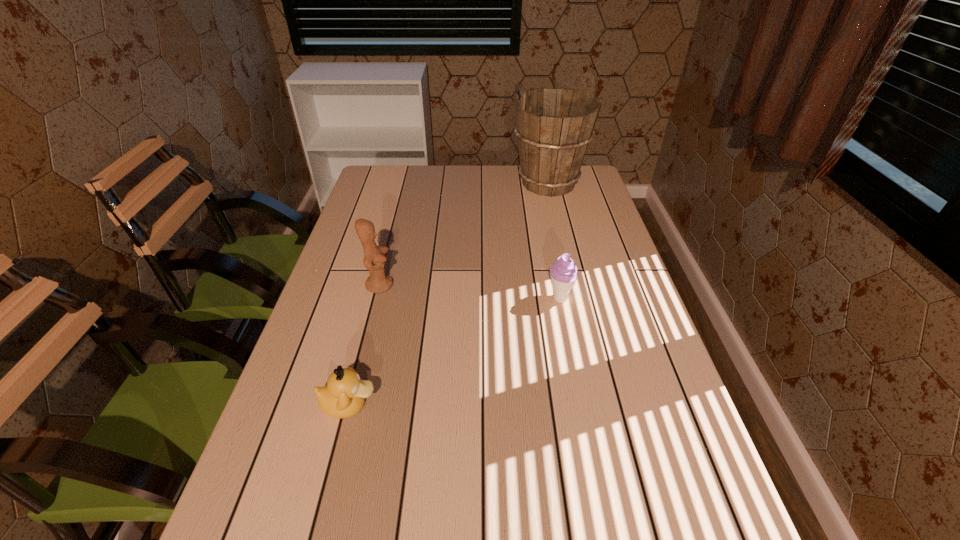
Image resolution: width=960 pixels, height=540 pixels. I want to click on object at the far edge, so click(554, 126).

Locate an element on the screen. The width and height of the screenshot is (960, 540). figurine positioned at the left edge is located at coordinates (378, 282).

Identify the location of duckling that is positioned at the left edge. Image resolution: width=960 pixels, height=540 pixels. (343, 397).

At what (x,y) coordinates should I click in order to perform the action: click on object situated at the right edge. Please return your answer as a coordinate pair (x, y). The width and height of the screenshot is (960, 540). Looking at the image, I should click on (554, 126).

Locate an element on the screen. This screenshot has width=960, height=540. object located at the far right corner is located at coordinates (554, 126).

At what (x,y) coordinates should I click in order to perform the action: click on free spot at the far edge of the desktop. Please return your answer as a coordinate pair (x, y). The width and height of the screenshot is (960, 540). Looking at the image, I should click on (417, 175).

Locate an element on the screen. free region at the left edge is located at coordinates (393, 253).

In the image, there is a desktop. Identify the location of vacant space at the right edge. 567,209.

You are a GUI agent. You are given a task and a screenshot of the screen. Output one action in this format:
    pyautogui.click(x=<x>, y=<y>)
    Task: Click on the vacant space at the far left corner of the desktop
    The image size is (960, 540).
    Given the screenshot: What is the action you would take?
    pyautogui.click(x=362, y=195)

The width and height of the screenshot is (960, 540). In the image, there is a desktop. In order to click on free space at the far right corner in this screenshot , I will do `click(591, 187)`.